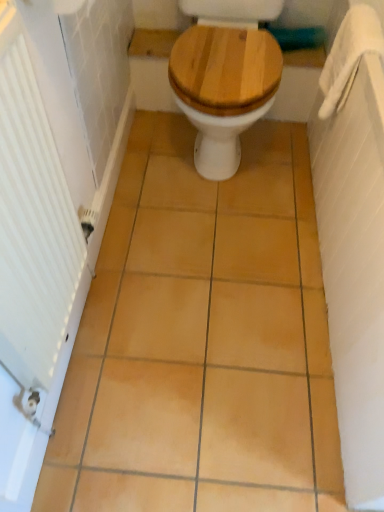
Question: Is white fabric towel bar at upper right facing away from matte yellow tile at center?

Choices:
 (A) no
 (B) yes

Answer: (A)

Question: Can you confirm if white fabric towel bar at upper right is bigger than matte yellow tile at center?

Choices:
 (A) no
 (B) yes

Answer: (A)

Question: Can you confirm if white fabric towel bar at upper right is smaller than matte yellow tile at center?

Choices:
 (A) yes
 (B) no

Answer: (A)

Question: Is white fabric towel bar at upper right behind matte yellow tile at center?

Choices:
 (A) yes
 (B) no

Answer: (A)

Question: From the image's perspective, is white fabric towel bar at upper right under matte yellow tile at center?

Choices:
 (A) no
 (B) yes

Answer: (A)

Question: From the image's perspective, is white textured radiator at left above or below wooden at center?

Choices:
 (A) below
 (B) above

Answer: (A)

Question: Considering the positions of white textured radiator at left and wooden at center in the image, is white textured radiator at left taller or shorter than wooden at center?

Choices:
 (A) short
 (B) tall

Answer: (B)

Question: Is white textured radiator at left in front of or behind wooden at center in the image?

Choices:
 (A) front
 (B) behind

Answer: (A)

Question: Is white textured radiator at left situated inside wooden at center or outside?

Choices:
 (A) inside
 (B) outside

Answer: (B)

Question: From the image's perspective, is white fabric towel bar at upper right located above or below white textured radiator at left?

Choices:
 (A) below
 (B) above

Answer: (B)

Question: From a real-world perspective, relative to white textured radiator at left, is white fabric towel bar at upper right vertically above or below?

Choices:
 (A) below
 (B) above

Answer: (A)

Question: Looking at their shapes, would you say white fabric towel bar at upper right is wider or thinner than white textured radiator at left?

Choices:
 (A) wide
 (B) thin

Answer: (A)

Question: Based on their positions, is white fabric towel bar at upper right located to the left or right of white textured radiator at left?

Choices:
 (A) left
 (B) right

Answer: (B)

Question: In terms of size, does white fabric towel bar at upper right appear bigger or smaller than matte yellow tile at center?

Choices:
 (A) small
 (B) big

Answer: (A)

Question: Considering the relative positions of white fabric towel bar at upper right and matte yellow tile at center in the image provided, is white fabric towel bar at upper right to the left or to the right of matte yellow tile at center?

Choices:
 (A) left
 (B) right

Answer: (B)